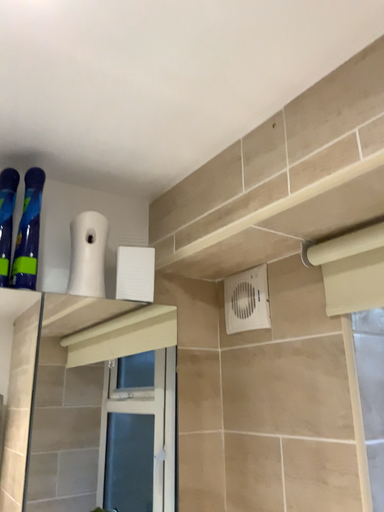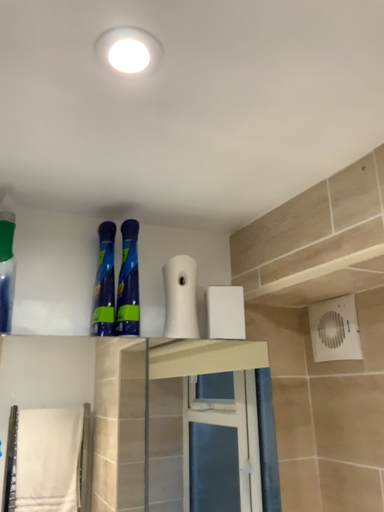
Question: Which way did the camera rotate in the video?

Choices:
 (A) rotated right
 (B) rotated left

Answer: (B)